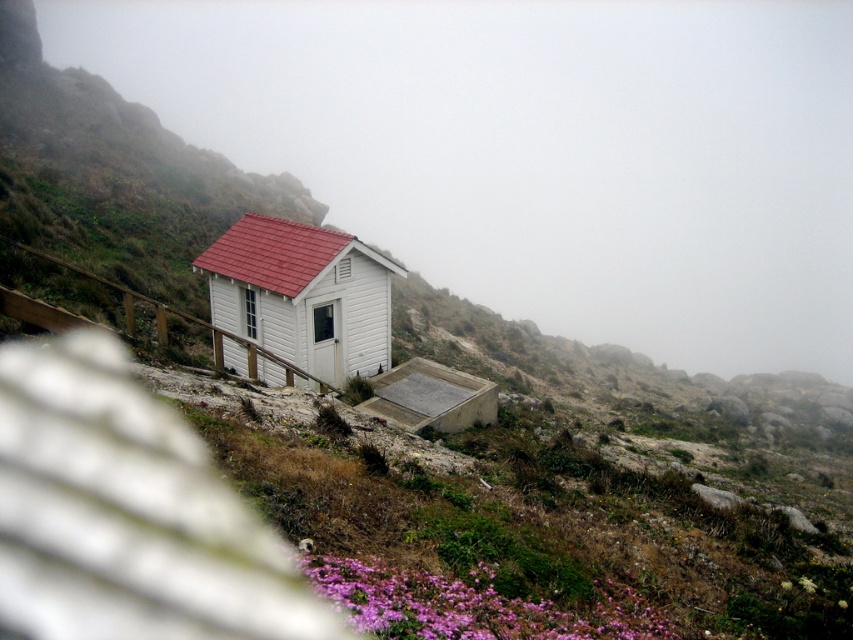
You are planning to build a small garden between the white wood cabin at center and the purple matte flowers at lower center. Considering their widths, which object should you place closer to the narrower side to ensure the garden fits properly?

The white wood cabin at center has a lesser width compared to purple matte flowers at lower center, so you should place the garden closer to the white wood cabin at center to accommodate the narrower space.

In the scene shown: You are a hiker who wants to take a photo of the white wood cabin at center and the purple matte flowers at lower center. Which object should you focus on first if you want to capture both in a single frame without moving your camera?

The white wood cabin at center is smaller than the purple matte flowers at lower center, so you should focus on the white wood cabin at center first to ensure it is in clear view before adjusting the frame to include the larger purple matte flowers at lower center.